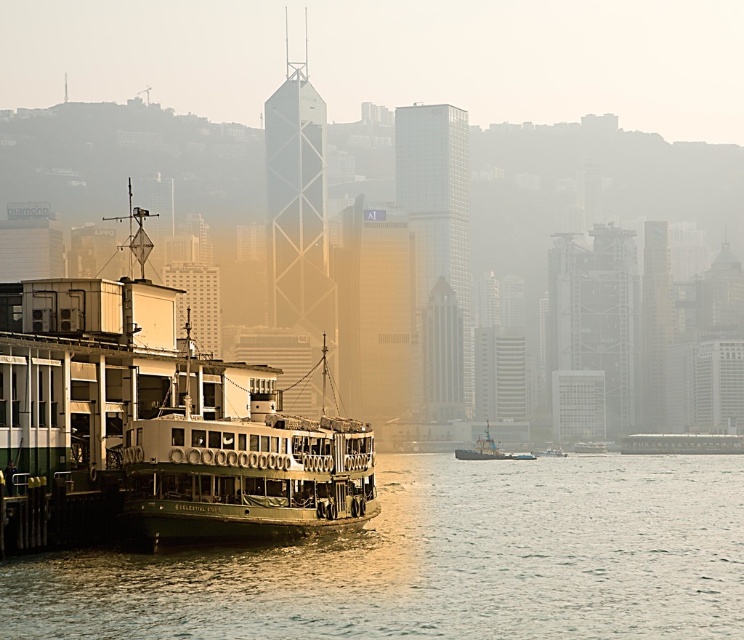
Question: Which object is the farthest from the metallic gray tugboat at center?

Choices:
 (A) smooth water at lower left
 (B) green painted wood ferry at left

Answer: (B)

Question: Which object is closer to the camera taking this photo?

Choices:
 (A) green painted wood ferry at left
 (B) metallic gray tugboat at center

Answer: (A)

Question: Which point is farther to the camera?

Choices:
 (A) green painted wood ferry at left
 (B) metallic gray tugboat at center
 (C) smooth water at lower left
 (D) green matte ferry at center

Answer: (B)

Question: Does green painted wood ferry at left lie behind green matte ferry at center?

Choices:
 (A) no
 (B) yes

Answer: (B)

Question: Does green painted wood ferry at left appear on the left side of metallic gray tugboat at center?

Choices:
 (A) no
 (B) yes

Answer: (B)

Question: Can you confirm if smooth water at lower left is wider than green painted wood ferry at left?

Choices:
 (A) no
 (B) yes

Answer: (B)